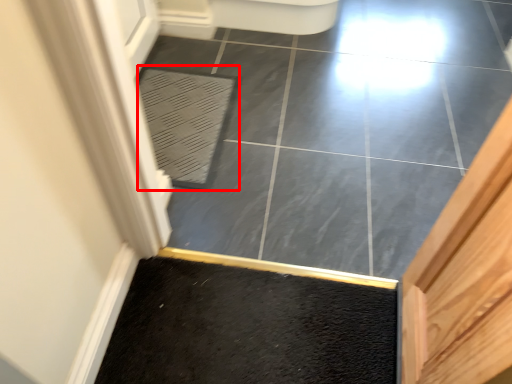
Question: Observing the image, what is the correct spatial positioning of bath mat (annotated by the red box) in reference to ceramic tile?

Choices:
 (A) right
 (B) left

Answer: (B)